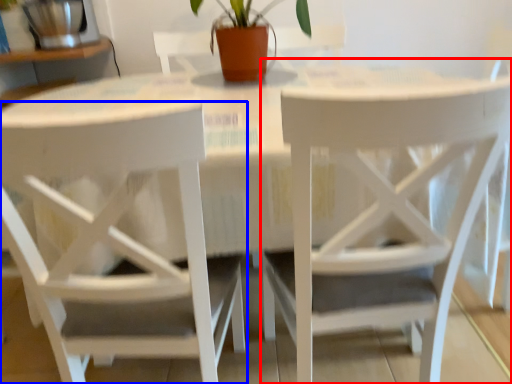
Question: Among these objects, which one is farthest to the camera, chair (highlighted by a red box) or chair (highlighted by a blue box)?

Choices:
 (A) chair
 (B) chair

Answer: (A)